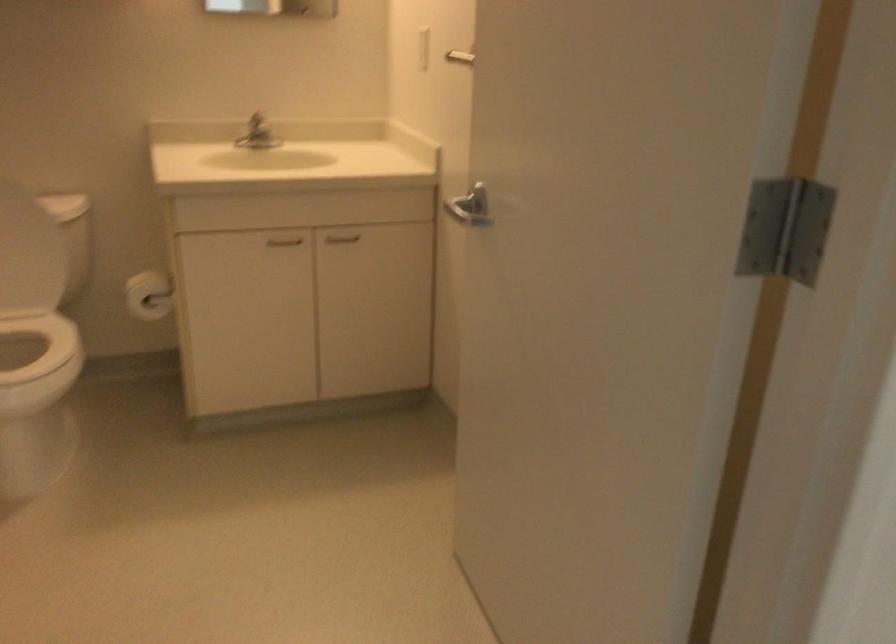
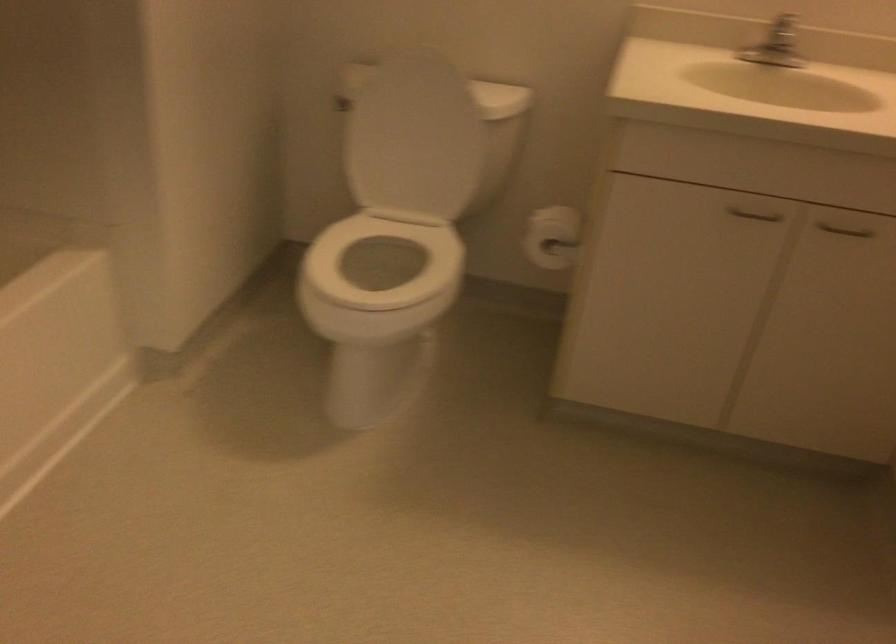
Where in the second image is the point corresponding to point (343, 236) from the first image?

(845, 230)